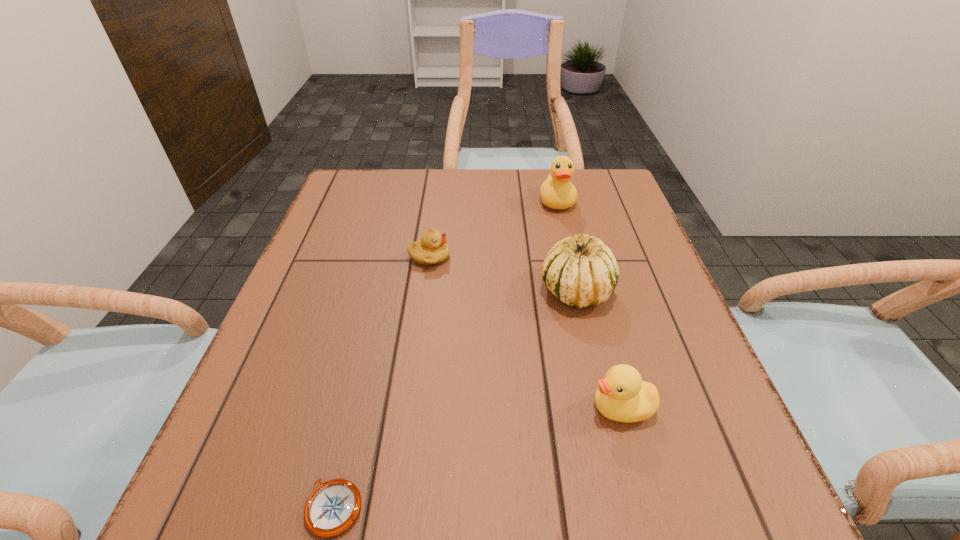
Find the location of a particular element. The height and width of the screenshot is (540, 960). free space between the duckling and the farthest object is located at coordinates (493, 230).

Identify the location of empty location between the second shortest object and the gourd. (502, 274).

Find the location of a particular element. free space that is in between the duckling and the third shortest object is located at coordinates (525, 333).

Where is `empty space that is in between the shortest object and the gourd`? The image size is (960, 540). empty space that is in between the shortest object and the gourd is located at coordinates (455, 399).

Find the location of a particular element. The image size is (960, 540). vacant area that lies between the second shortest object and the shortest object is located at coordinates (382, 383).

At what (x,y) coordinates should I click in order to perform the action: click on unoccupied area between the duckling and the nearest object. Please return your answer as a coordinate pair (x, y). Looking at the image, I should click on (382, 383).

The width and height of the screenshot is (960, 540). In order to click on vacant area that lies between the gourd and the duckling in this screenshot , I will do `click(502, 274)`.

This screenshot has width=960, height=540. I want to click on the closest object to the gourd, so click(x=622, y=396).

Identify which object is located as the fourth nearest to the fourth farthest object. Please provide its 2D coordinates. Your answer should be formatted as a tuple, i.e. [(x, y)], where the tuple contains the x and y coordinates of a point satisfying the conditions above.

[(557, 192)]

Where is `vacant space that satisfies the following two spatial constraints: 1. at the beak of the gourd; 2. on the left side of the duckling`? vacant space that satisfies the following two spatial constraints: 1. at the beak of the gourd; 2. on the left side of the duckling is located at coordinates (425, 290).